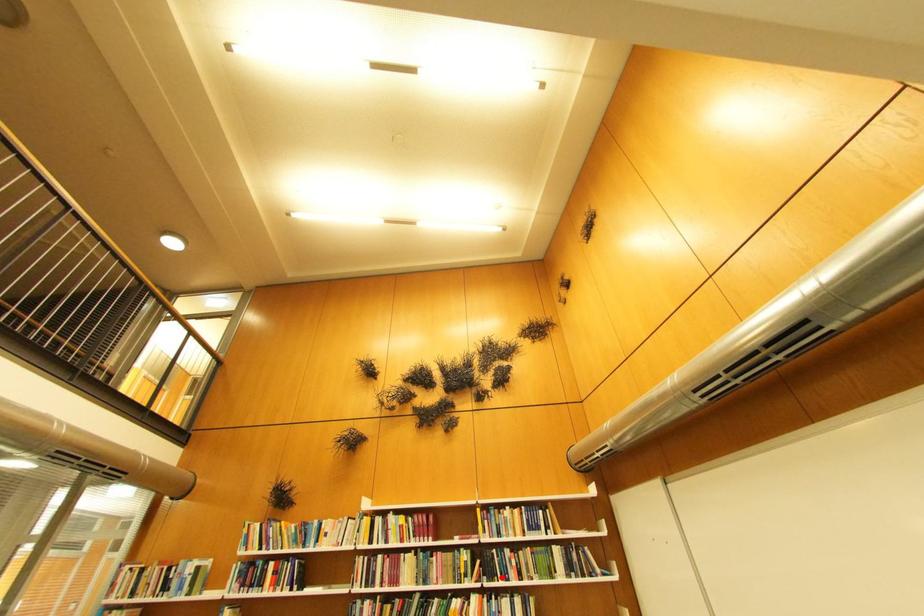
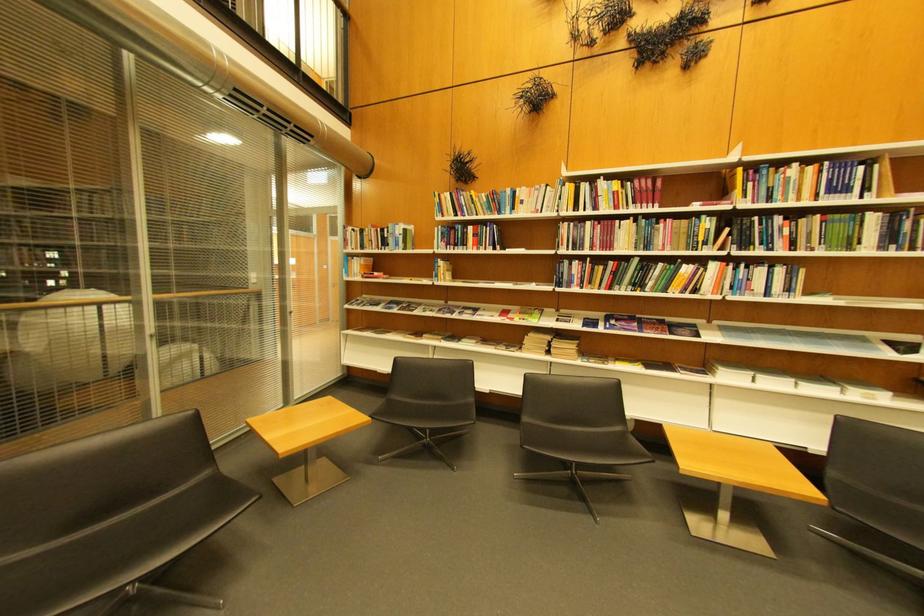
Locate, in the second image, the point that corresponds to the highlighted location in the first image.

(756, 246)